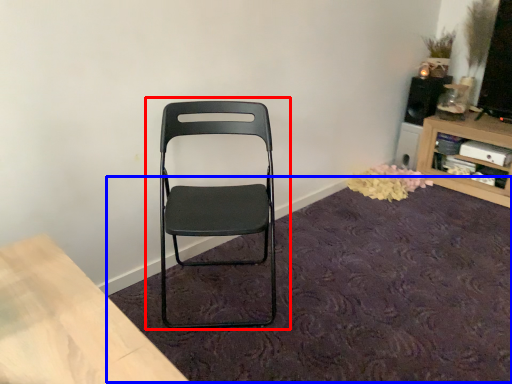
Question: Which object appears closest to the camera in this image, chair (highlighted by a red box) or mat (highlighted by a blue box)?

Choices:
 (A) chair
 (B) mat

Answer: (B)